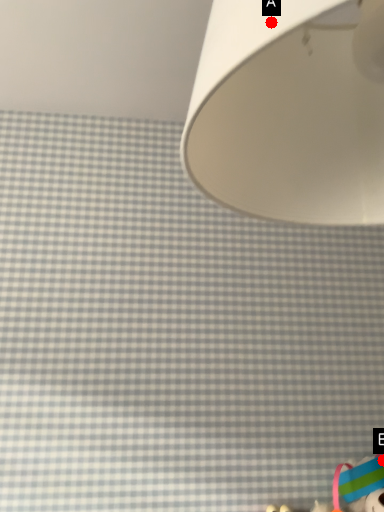
Question: Two points are circled on the image, labeled by A and B beside each circle. Which point is farther from the camera taking this photo?

Choices:
 (A) A is further
 (B) B is further

Answer: (B)